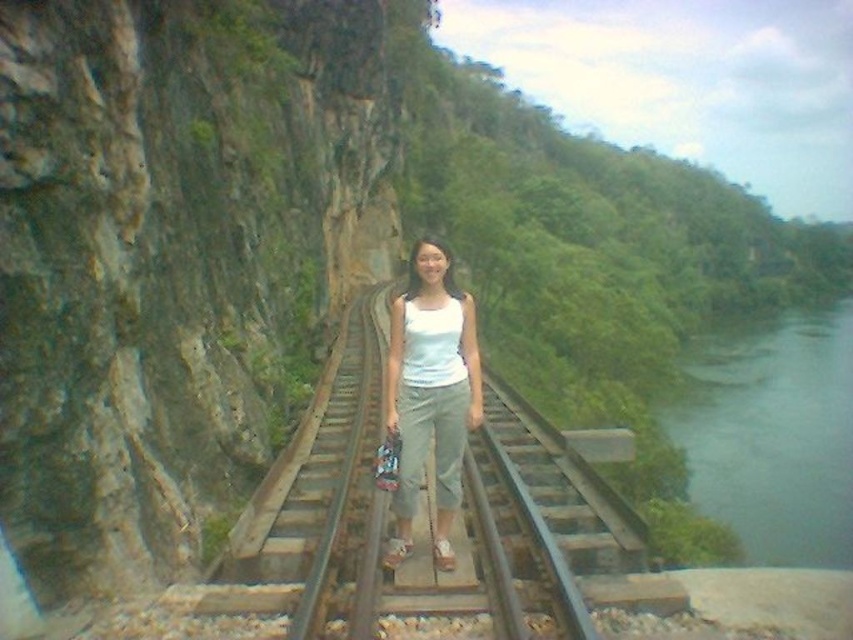
Question: From the image, what is the correct spatial relationship of green water at right in relation to white cotton tank top at center?

Choices:
 (A) left
 (B) right

Answer: (B)

Question: Is green water at right wider than white cotton tank top at center?

Choices:
 (A) yes
 (B) no

Answer: (A)

Question: Which point appears farthest from the camera in this image?

Choices:
 (A) (437, 259)
 (B) (793, 531)

Answer: (B)

Question: Can you confirm if green water at right is bigger than white cotton tank top at center?

Choices:
 (A) yes
 (B) no

Answer: (A)

Question: Which point appears closest to the camera in this image?

Choices:
 (A) (802, 525)
 (B) (469, 396)

Answer: (B)